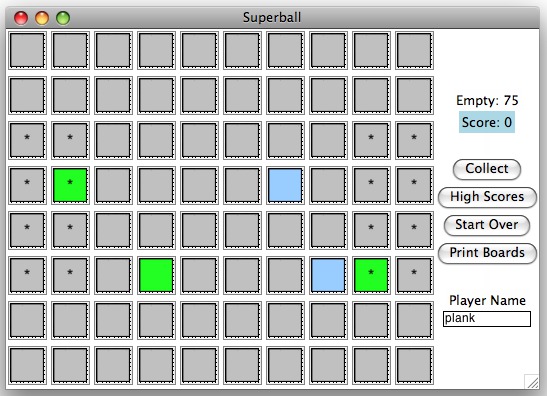
Find the location of `yellow circular 'light'`. yellow circular 'light' is located at coordinates (42, 14).